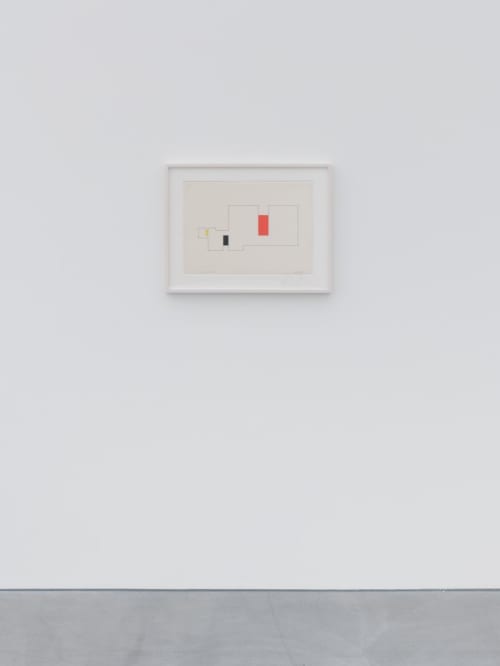
Locate an element on the screen. This screenshot has height=666, width=500. wall above frame is located at coordinates (233, 74).